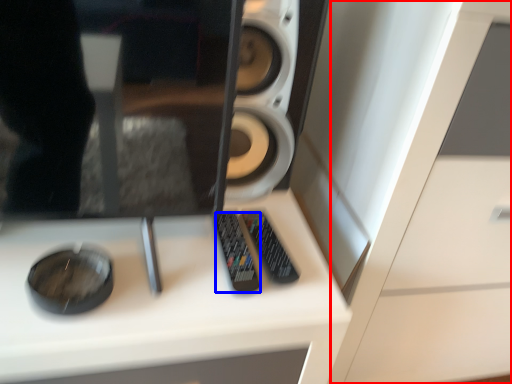
Question: Which object appears closest to the camera in this image, dresser (highlighted by a red box) or control (highlighted by a blue box)?

Choices:
 (A) dresser
 (B) control

Answer: (A)